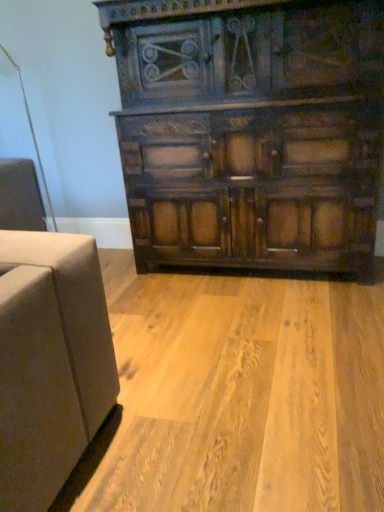
Locate an element on the screen. This screenshot has height=512, width=384. free space in front of dark wood cabinet at center is located at coordinates (254, 343).